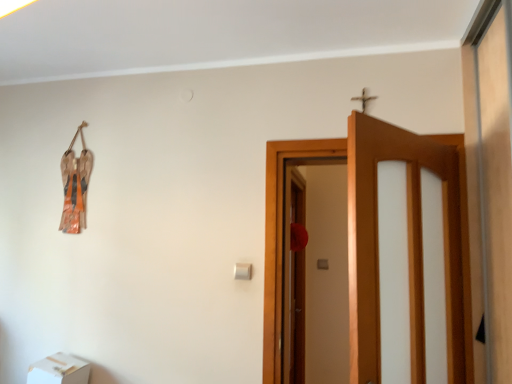
Looking at this image, measure the distance between point [455,188] and camera.

They are 1.95 meters apart.

This screenshot has width=512, height=384. Describe the element at coordinates (377, 242) in the screenshot. I see `wooden door at center` at that location.

This screenshot has width=512, height=384. In order to click on wooden door at center in this screenshot , I will do `click(377, 242)`.

The width and height of the screenshot is (512, 384). What do you see at coordinates (59, 370) in the screenshot? I see `white cardboard box at lower left` at bounding box center [59, 370].

The image size is (512, 384). In order to click on white cardboard box at lower left in this screenshot , I will do `click(59, 370)`.

The height and width of the screenshot is (384, 512). In order to click on wooden door at center in this screenshot , I will do `click(377, 242)`.

Based on the photo, which is more to the left, white cardboard box at lower left or wooden door at center?

Positioned to the left is white cardboard box at lower left.

Is the depth of white cardboard box at lower left greater than that of wooden door at center?

Yes.

Between point (69, 373) and point (418, 244), which one is positioned in front?

The point (418, 244) is more forward.

From the image's perspective, who appears lower, white cardboard box at lower left or wooden door at center?

From the image's view, white cardboard box at lower left is below.

From a real-world perspective, is white cardboard box at lower left positioned under wooden door at center based on gravity?

Yes, from a real-world perspective, white cardboard box at lower left is under wooden door at center.

Which object is wider, white cardboard box at lower left or wooden door at center?

Wider between the two is wooden door at center.

In the scene shown: Does white cardboard box at lower left have a lesser height compared to wooden door at center?

Correct, white cardboard box at lower left is not as tall as wooden door at center.

Considering the sizes of objects white cardboard box at lower left and wooden door at center in the image provided, who is smaller, white cardboard box at lower left or wooden door at center?

white cardboard box at lower left is smaller.

Which is correct: white cardboard box at lower left is inside wooden door at center, or outside of it?

The correct answer is: outside.

Is white cardboard box at lower left in contact with wooden door at center?

No, white cardboard box at lower left is not beside wooden door at center.

Consider the image. Is white cardboard box at lower left facing towards wooden door at center?

No, white cardboard box at lower left is not turned towards wooden door at center.

How different are the orientations of white cardboard box at lower left and wooden door at center in degrees?

2.86 degrees separate the facing orientations of white cardboard box at lower left and wooden door at center.

In order to click on furniture below the wooden door at center (from the image's perspective) in this screenshot , I will do `click(59, 370)`.

Would you say wooden door at center is to the left or to the right of white cardboard box at lower left in the picture?

Based on their positions, wooden door at center is located to the right of white cardboard box at lower left.

Which is in front, wooden door at center or white cardboard box at lower left?

wooden door at center is in front.

Is point (277, 330) closer or farther from the camera than point (47, 357)?

Point (277, 330) is closer to the camera than point (47, 357).

From the image's perspective, is wooden door at center on top of white cardboard box at lower left?

Yes.

From a real-world perspective, is wooden door at center positioned above or below white cardboard box at lower left?

In terms of real-world spatial position, wooden door at center is above white cardboard box at lower left.

Does wooden door at center have a greater width compared to white cardboard box at lower left?

Indeed, wooden door at center has a greater width compared to white cardboard box at lower left.

Which of these two, wooden door at center or white cardboard box at lower left, stands taller?

wooden door at center is taller.

Looking at the image, does wooden door at center seem bigger or smaller compared to white cardboard box at lower left?

Considering their sizes, wooden door at center takes up more space than white cardboard box at lower left.

Is white cardboard box at lower left inside wooden door at center?

No, white cardboard box at lower left is not inside wooden door at center.

Are wooden door at center and white cardboard box at lower left making contact?

No, wooden door at center is not with white cardboard box at lower left.

Is wooden door at center facing towards white cardboard box at lower left?

No, wooden door at center is not turned towards white cardboard box at lower left.

Can you tell me how much wooden door at center and white cardboard box at lower left differ in facing direction?

The angular difference between wooden door at center and white cardboard box at lower left is 2.86 degrees.

Find the location of a particular element. The height and width of the screenshot is (384, 512). furniture that is below the wooden door at center (from the image's perspective) is located at coordinates (59, 370).

This screenshot has width=512, height=384. What are the coordinates of `door that appears above the white cardboard box at lower left (from the image's perspective)` in the screenshot? It's located at (377, 242).

At what (x,y) coordinates should I click in order to perform the action: click on door that appears on the right of white cardboard box at lower left. Please return your answer as a coordinate pair (x, y). Looking at the image, I should click on (377, 242).